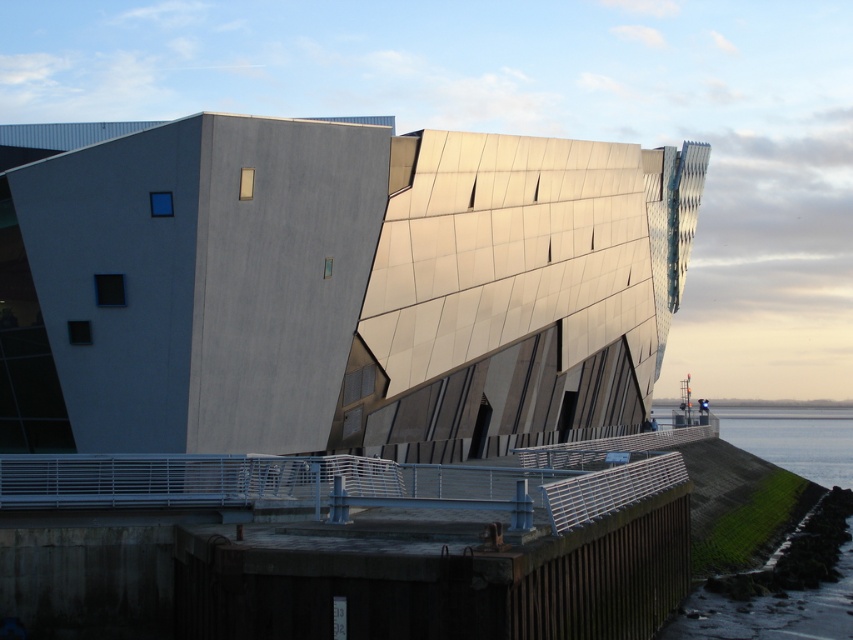
Who is more distant from viewer, (276, 433) or (805, 461)?

Positioned behind is point (805, 461).

Is metallic glass building at center wider than clear water at lower right?

Incorrect, metallic glass building at center's width does not surpass clear water at lower right's.

Find the location of a particular element. The image size is (853, 640). metallic glass building at center is located at coordinates tap(332, 285).

Is metallic glass building at center positioned behind concrete dock at lower center?

Yes, it is behind concrete dock at lower center.

Which is more to the left, metallic glass building at center or concrete dock at lower center?

concrete dock at lower center

Which is in front, point (577, 429) or point (624, 480)?

Point (624, 480) is more forward.

Locate an element on the screen. The image size is (853, 640). metallic glass building at center is located at coordinates (332, 285).

Which of these two, concrete dock at lower center or clear water at lower right, stands taller?

clear water at lower right

Does concrete dock at lower center have a greater height compared to clear water at lower right?

In fact, concrete dock at lower center may be shorter than clear water at lower right.

The height and width of the screenshot is (640, 853). What do you see at coordinates (347, 550) in the screenshot? I see `concrete dock at lower center` at bounding box center [347, 550].

Locate an element on the screen. concrete dock at lower center is located at coordinates (347, 550).